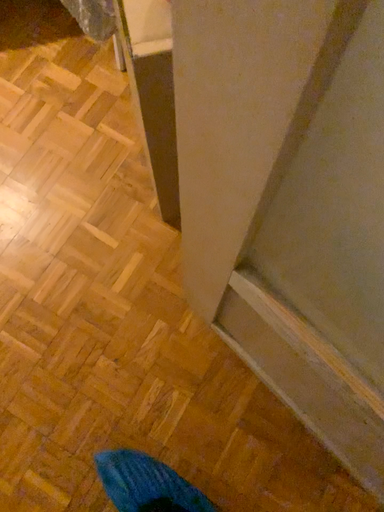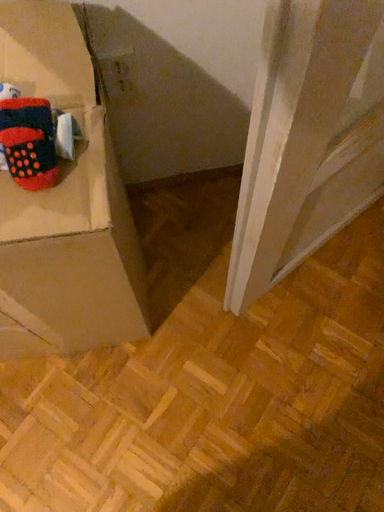
Question: How did the camera likely rotate when shooting the video?

Choices:
 (A) rotated upward
 (B) rotated downward

Answer: (A)